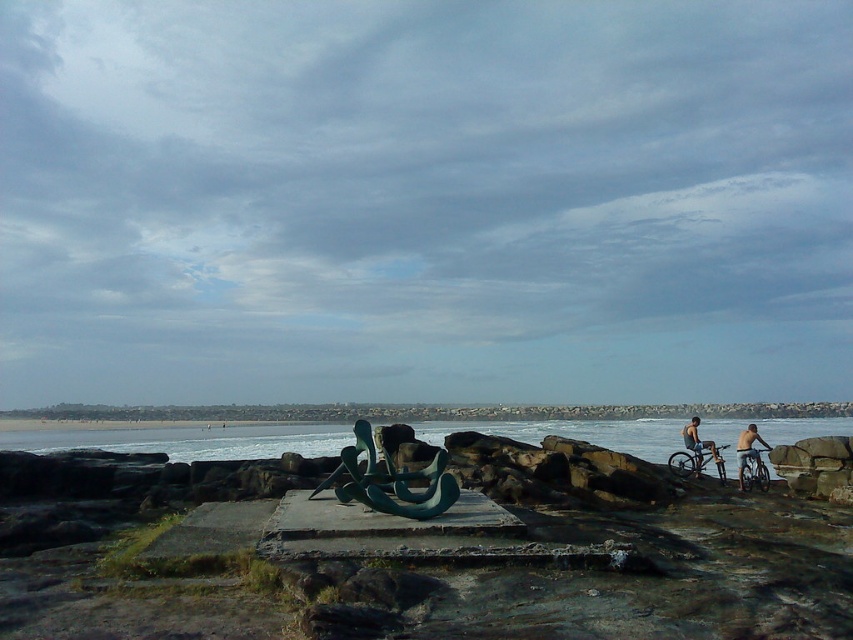
What do you see at coordinates (189, 440) in the screenshot? I see `blue water at lower left` at bounding box center [189, 440].

Measure the distance between blue water at lower left and silver metallic bicycle at right.

63.83 feet

Which is behind, point (90, 435) or point (672, 456)?

Positioned behind is point (90, 435).

Find the location of a particular element. blue water at lower left is located at coordinates [x=189, y=440].

Which of these two, silver metallic bicycle at right or skinny man on bicycle at right, stands shorter?

silver metallic bicycle at right is shorter.

The width and height of the screenshot is (853, 640). Identify the location of silver metallic bicycle at right. (688, 461).

Image resolution: width=853 pixels, height=640 pixels. Find the location of `silver metallic bicycle at right`. silver metallic bicycle at right is located at coordinates (688, 461).

Is metallic silver bicycles at right thinner than shiny metallic bicycle at right?

Incorrect, metallic silver bicycles at right's width is not less than shiny metallic bicycle at right's.

Can you confirm if metallic silver bicycles at right is taller than shiny metallic bicycle at right?

Indeed, metallic silver bicycles at right has a greater height compared to shiny metallic bicycle at right.

Which is in front, point (688, 429) or point (744, 486)?

Point (744, 486)

You are a GUI agent. You are given a task and a screenshot of the screen. Output one action in this format:
    pyautogui.click(x=<x>, y=<y>)
    Task: Click on the metallic silver bicycles at right
    The height and width of the screenshot is (640, 853).
    Given the screenshot: What is the action you would take?
    pyautogui.click(x=695, y=452)